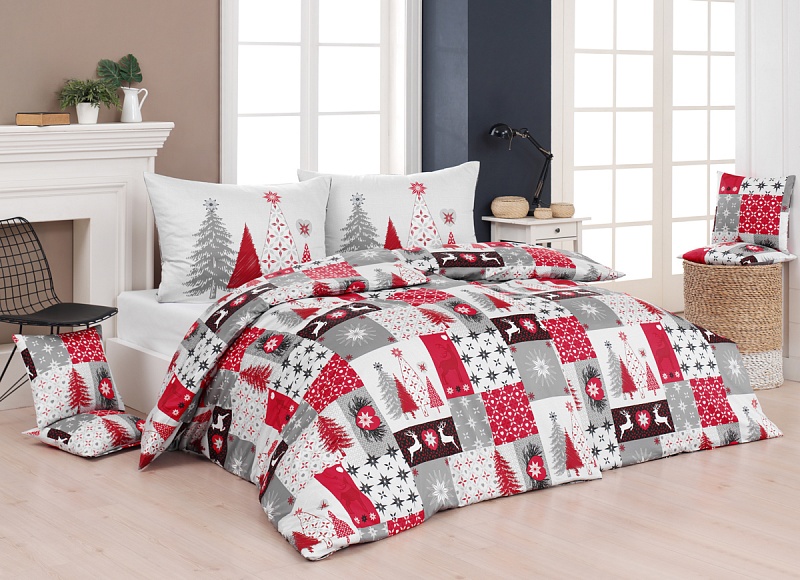
You are a GUI agent. You are given a task and a screenshot of the screen. Output one action in this format:
    pyautogui.click(x=<x>, y=<y>)
    Task: Click on the pillows
    
    Given the screenshot: What is the action you would take?
    pyautogui.click(x=756, y=217), pyautogui.click(x=450, y=199), pyautogui.click(x=301, y=209), pyautogui.click(x=737, y=253), pyautogui.click(x=72, y=367), pyautogui.click(x=90, y=435)